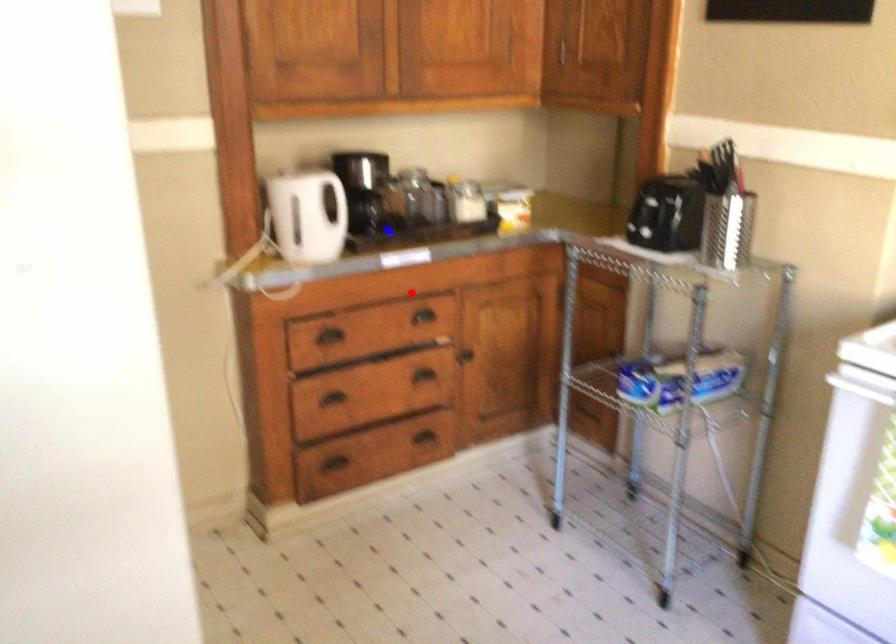
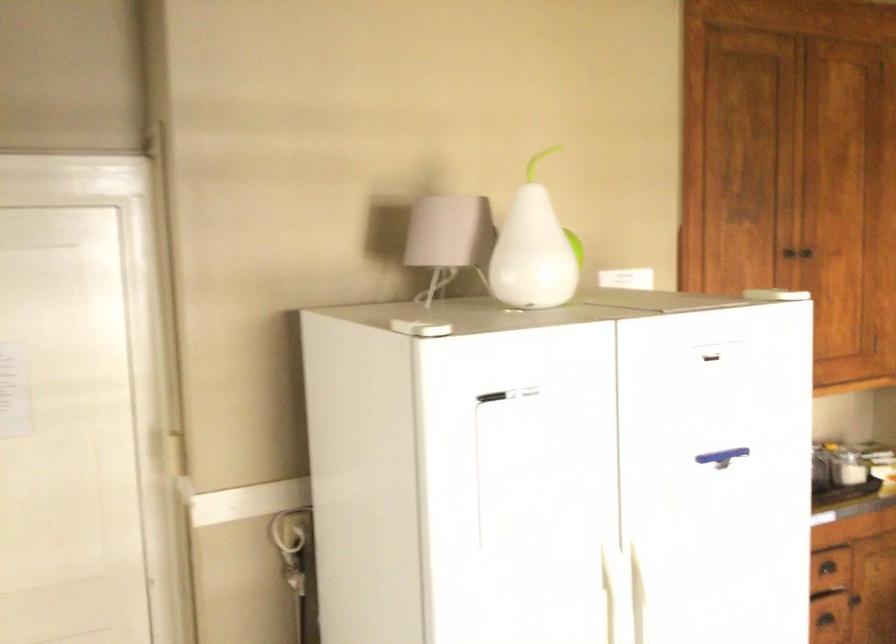
Question: I am providing you with two images of the same scene from different viewpoints. Image1 has a red point marked. In image2, the corresponding 3D location appears at what relative position? Reply with the corresponding letter.

Choices:
 (A) Closer
 (B) Farther

Answer: (B)